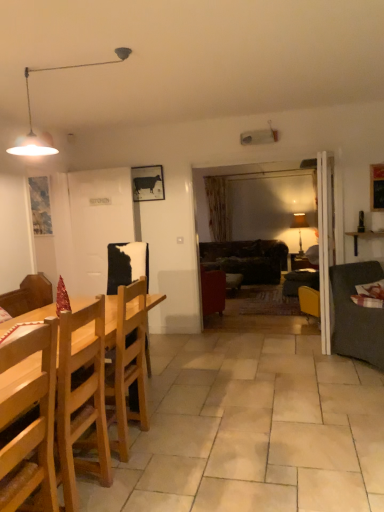
Question: From the image's perspective, is light brown wooden chair at left, the first chair when ordered from back to front, above or below dark brown leather couch at center, which is counted as the 1th studio couch, starting from the back?

Choices:
 (A) below
 (B) above

Answer: (A)

Question: In terms of width, does light brown wooden chair at left, which ranks as the 2th chair in front-to-back order, look wider or thinner when compared to dark brown leather couch at center, the 2th studio couch from the front?

Choices:
 (A) thin
 (B) wide

Answer: (A)

Question: Which of these objects is positioned closest to the light brown wooden chair at left, the first chair when ordered from back to front?

Choices:
 (A) matte black lamp at right, placed as the second lamp when sorted from top to bottom
 (B) wooden picture frame at left, positioned as the 2th picture frame in right-to-left order
 (C) metallic cow print at upper center, the 2th picture frame viewed from the left
 (D) metallic pendant light at upper left, the first lamp in the top-to-bottom sequence
 (E) dark brown leather couch at center, which is counted as the 1th studio couch, starting from the back

Answer: (D)

Question: Estimate the real-world distances between objects in this image. Which object is closer to the wooden shelf at right?

Choices:
 (A) light brown wooden chair at left, the first chair when ordered from back to front
 (B) wooden picture frame at left, positioned as the 2th picture frame in right-to-left order
 (C) light wood chair at left, positioned as the 1th chair in front-to-back order
 (D) metallic pendant light at upper left, which ranks as the 2th lamp in right-to-left order
 (E) dark gray fabric couch at right, which appears as the second studio couch when viewed from the back

Answer: (E)